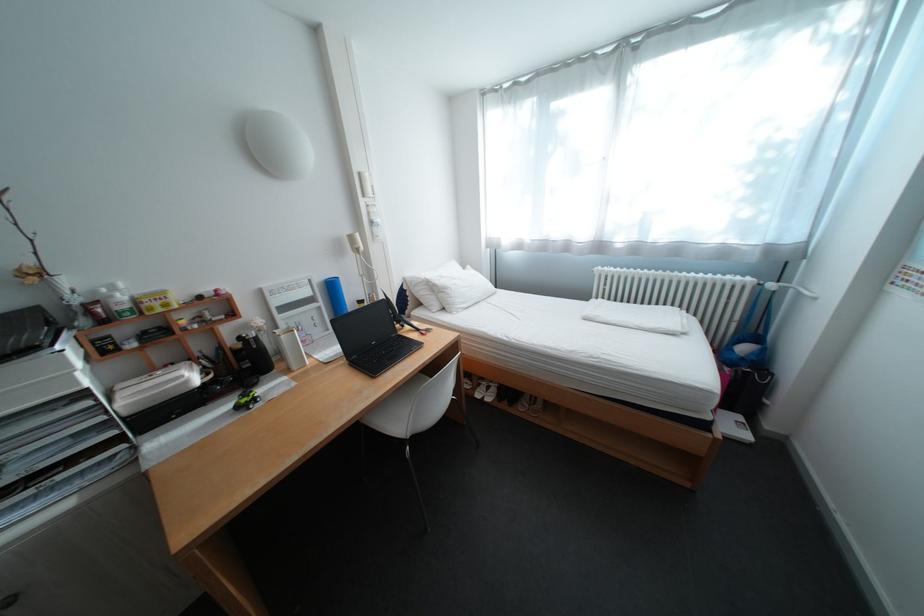
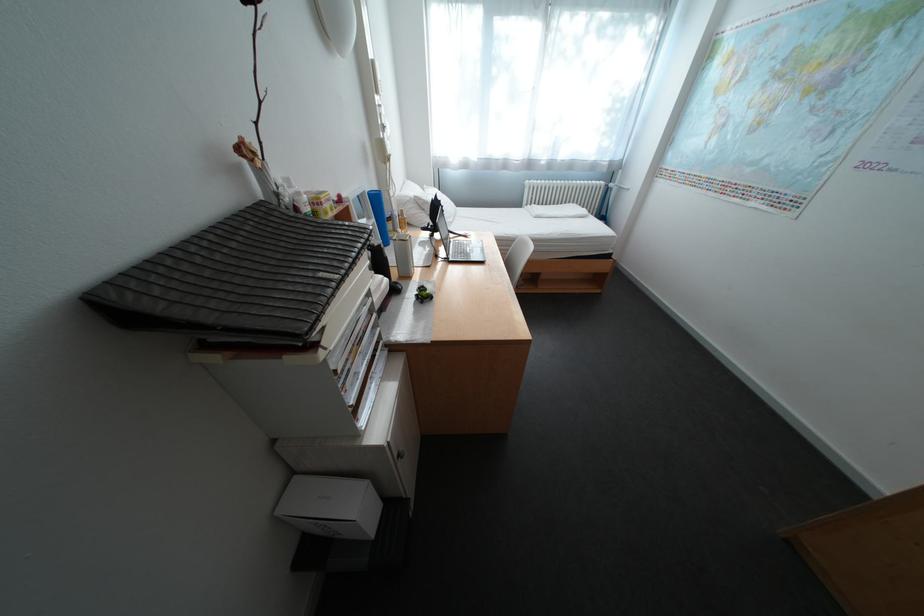
In the second image, find the point that corresponds to the point at 432,282 in the first image.

(420, 200)